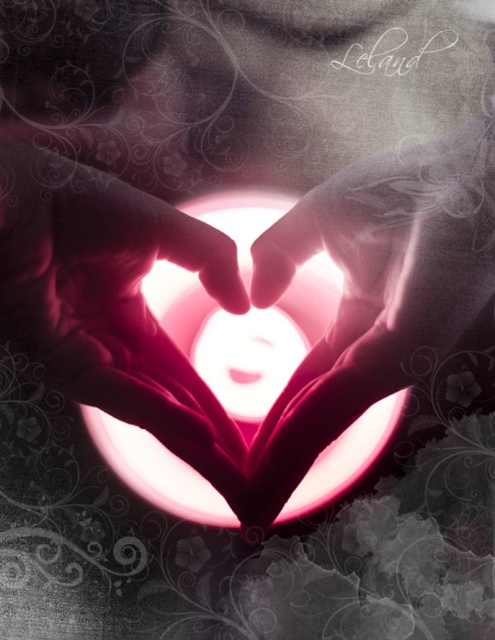
Question: Considering the relative positions of smooth skin hand at center and translucent pink heart at center in the image provided, where is smooth skin hand at center located with respect to translucent pink heart at center?

Choices:
 (A) above
 (B) below

Answer: (A)

Question: Is smooth skin hand at center wider than translucent pink heart at center?

Choices:
 (A) yes
 (B) no

Answer: (B)

Question: Which object appears farthest from the camera in this image?

Choices:
 (A) translucent pink heart at center
 (B) smooth skin hand at center

Answer: (A)

Question: Does smooth skin hand at center have a lesser width compared to translucent pink heart at center?

Choices:
 (A) yes
 (B) no

Answer: (A)